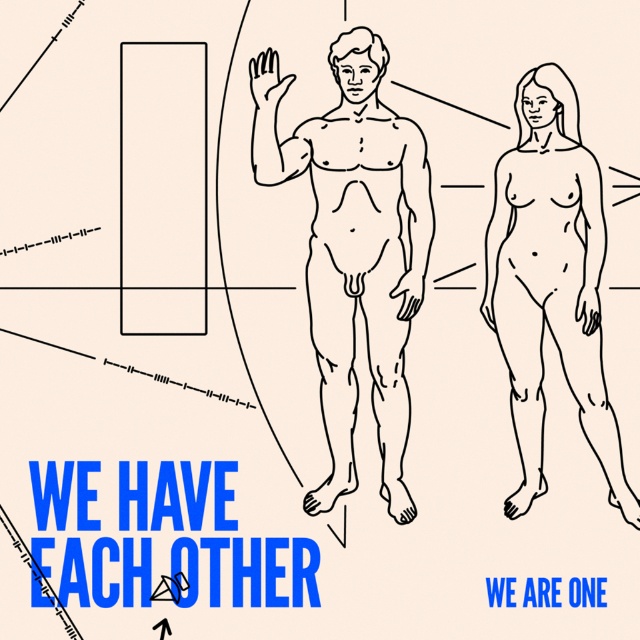
You are an artist analyzing the composition of the image. You notice two points plotted on the drawing. The first point is at coordinates point (349, 180) and the second at point (563, 266). Based on their positions, which point is closer to the viewer?

Point (349, 180) is in front of point (563, 266), so it is closer to the viewer.